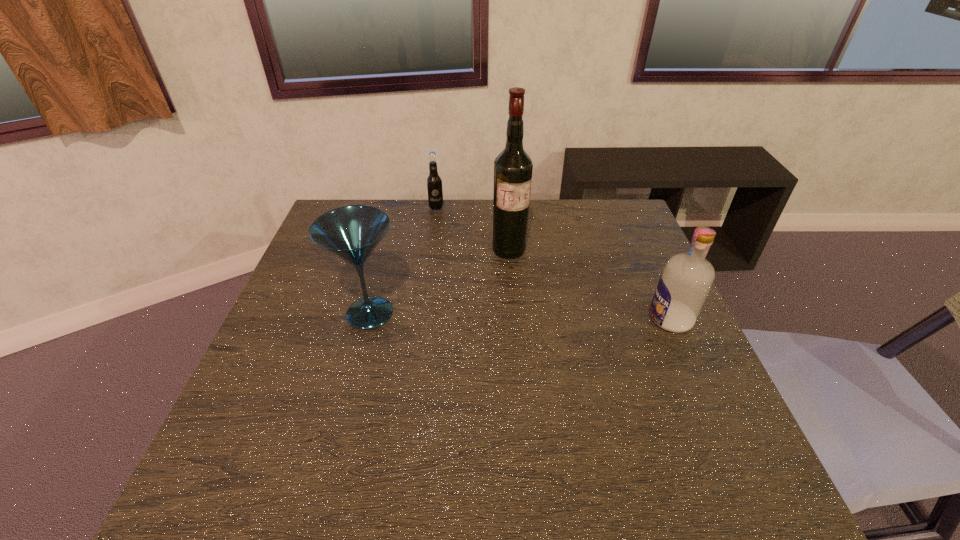
Locate an element on the screen. This screenshot has width=960, height=540. free space that satisfies the following two spatial constraints: 1. on the front side of the rightmost object; 2. on the label of the leftmost object is located at coordinates (369, 319).

At what (x,y) coordinates should I click in order to perform the action: click on free space that satisfies the following two spatial constraints: 1. on the front side of the rightmost object; 2. on the label of the shortest object. Please return your answer as a coordinate pair (x, y). Looking at the image, I should click on (420, 319).

Locate an element on the screen. This screenshot has width=960, height=540. vacant region that satisfies the following two spatial constraints: 1. on the front side of the third object from right to left; 2. on the label of the vodka is located at coordinates (420, 319).

Where is `free space in the image that satisfies the following two spatial constraints: 1. on the front side of the leftmost object; 2. on the label of the rightmost object`? Image resolution: width=960 pixels, height=540 pixels. free space in the image that satisfies the following two spatial constraints: 1. on the front side of the leftmost object; 2. on the label of the rightmost object is located at coordinates (369, 319).